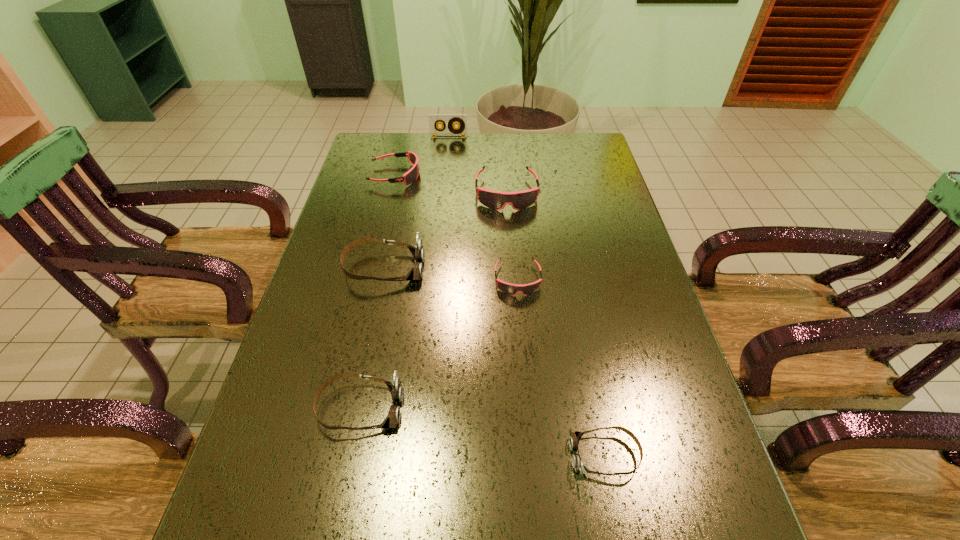
You are a GUI agent. You are given a task and a screenshot of the screen. Output one action in this format:
    pyautogui.click(x=<x>, y=<y>)
    Task: Click on the object that is at the far left corner
    This screenshot has height=540, width=960.
    Given the screenshot: What is the action you would take?
    [x=411, y=176]

The image size is (960, 540). I want to click on blank space at the far edge of the desktop, so click(420, 165).

Locate an element on the screen. The height and width of the screenshot is (540, 960). blank area at the left edge is located at coordinates point(298,454).

What are the coordinates of `vacant area at the far left corner` in the screenshot? It's located at (365, 144).

You are a GUI agent. You are given a task and a screenshot of the screen. Output one action in this format:
    pyautogui.click(x=<x>, y=<y>)
    Task: Click on the free space at the far right corner
    The width and height of the screenshot is (960, 540).
    Given the screenshot: What is the action you would take?
    pyautogui.click(x=558, y=160)

At what (x,y) coordinates should I click in order to perform the action: click on free space between the brown videotape and the biggest brown goggles. Please return your answer as a coordinate pair (x, y). The image size is (960, 540). Looking at the image, I should click on (417, 202).

Where is `free space between the smallest pink goggles and the farthest brown goggles`? free space between the smallest pink goggles and the farthest brown goggles is located at coordinates (451, 274).

I want to click on free space between the nearest pink goggles and the biggest pink goggles, so click(512, 236).

You are a GUI agent. You are given a task and a screenshot of the screen. Output one action in this format:
    pyautogui.click(x=<x>, y=<y>)
    Task: Click on the free spot between the videotape and the smallest pink goggles
    The height and width of the screenshot is (540, 960).
    Given the screenshot: What is the action you would take?
    pyautogui.click(x=483, y=208)

The height and width of the screenshot is (540, 960). I want to click on vacant space in between the biggest brown goggles and the biggest pink goggles, so click(x=445, y=231).